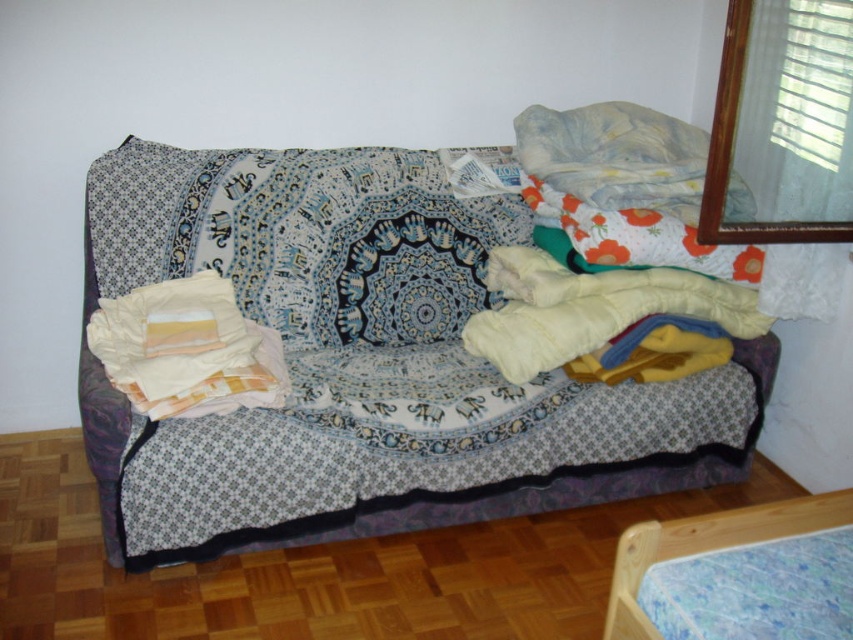
Question: Does patterned fabric couch at center appear on the right side of white soft pillow at center?

Choices:
 (A) yes
 (B) no

Answer: (A)

Question: Which object appears closest to the camera in this image?

Choices:
 (A) fluffy white pillow at center
 (B) white soft pillow at center
 (C) patterned fabric couch at center
 (D) blue floral mattress at lower right

Answer: (D)

Question: Is fluffy white pillow at center bigger than white soft pillow at center?

Choices:
 (A) no
 (B) yes

Answer: (B)

Question: Is fluffy white pillow at center positioned in front of white soft pillow at center?

Choices:
 (A) no
 (B) yes

Answer: (A)

Question: Which object is positioned farthest from the white soft pillow at center?

Choices:
 (A) fluffy white pillow at center
 (B) patterned fabric couch at center

Answer: (A)

Question: Among these points, which one is farthest from the camera?

Choices:
 (A) (201, 353)
 (B) (747, 513)

Answer: (A)